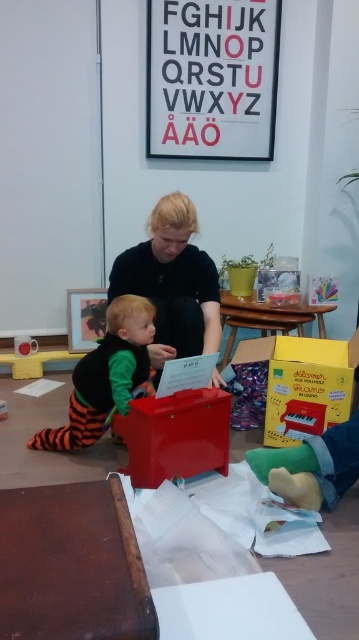
Is matte black sweater at center to the right of metallic red toy box at center from the viewer's perspective?

No, matte black sweater at center is not to the right of metallic red toy box at center.

Who is positioned more to the right, matte black sweater at center or metallic red toy box at center?

metallic red toy box at center

Between point (188, 323) and point (122, 420), which one is positioned behind?

The point (188, 323) is behind.

Identify the location of matte black sweater at center. tap(173, 282).

Based on the photo, can you confirm if matte black sweater at center is positioned above orange striped fabric toddler at lower left?

Correct, matte black sweater at center is located above orange striped fabric toddler at lower left.

Is the position of matte black sweater at center less distant than that of orange striped fabric toddler at lower left?

No, matte black sweater at center is further to the viewer.

I want to click on matte black sweater at center, so click(173, 282).

Find the location of a particular element. The width and height of the screenshot is (359, 640). matte black sweater at center is located at coordinates (173, 282).

Is metallic red toy box at center positioned before orange striped fabric toddler at lower left?

Yes, metallic red toy box at center is in front of orange striped fabric toddler at lower left.

Can you confirm if metallic red toy box at center is taller than orange striped fabric toddler at lower left?

No.

Is point (179, 468) farther from camera compared to point (98, 436)?

No.

Where is `metallic red toy box at center`? metallic red toy box at center is located at coordinates (174, 435).